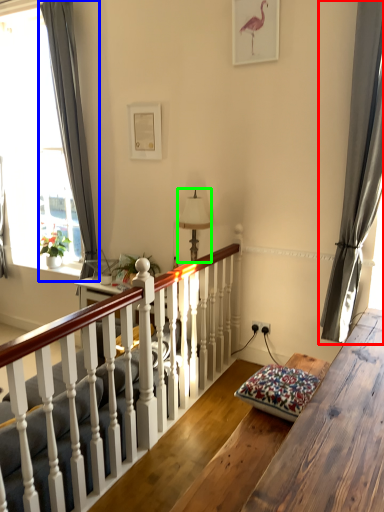
Question: Considering the real-world distances, which object is farthest from curtain (highlighted by a red box)? curtain (highlighted by a blue box) or lamp (highlighted by a green box)?

Choices:
 (A) curtain
 (B) lamp

Answer: (A)